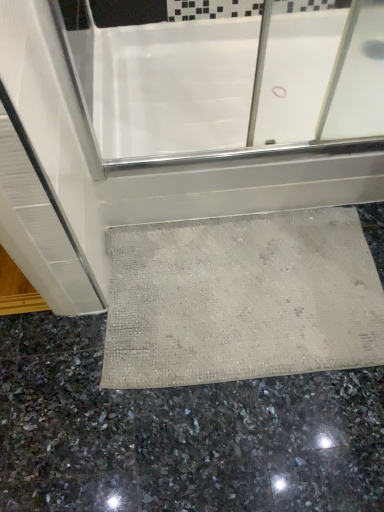
Question: Is white glossy bathtub at center positioned before beige textured bath mat at lower center?

Choices:
 (A) yes
 (B) no

Answer: (B)

Question: Is white glossy bathtub at center bigger than beige textured bath mat at lower center?

Choices:
 (A) yes
 (B) no

Answer: (A)

Question: Can you confirm if white glossy bathtub at center is taller than beige textured bath mat at lower center?

Choices:
 (A) yes
 (B) no

Answer: (A)

Question: Is white glossy bathtub at center wider than beige textured bath mat at lower center?

Choices:
 (A) no
 (B) yes

Answer: (B)

Question: From the image's perspective, is white glossy bathtub at center located beneath beige textured bath mat at lower center?

Choices:
 (A) yes
 (B) no

Answer: (B)

Question: From the image's perspective, is white glossy bathtub at center above or below beige textured bath mat at lower center?

Choices:
 (A) below
 (B) above

Answer: (B)

Question: Is white glossy bathtub at center inside the boundaries of beige textured bath mat at lower center, or outside?

Choices:
 (A) outside
 (B) inside

Answer: (A)

Question: In terms of width, does white glossy bathtub at center look wider or thinner when compared to beige textured bath mat at lower center?

Choices:
 (A) thin
 (B) wide

Answer: (B)

Question: Based on their positions, is white glossy bathtub at center located to the left or right of beige textured bath mat at lower center?

Choices:
 (A) right
 (B) left

Answer: (A)

Question: Considering the positions of white glossy bathtub at center and gray polished granite at lower center in the image, is white glossy bathtub at center wider or thinner than gray polished granite at lower center?

Choices:
 (A) thin
 (B) wide

Answer: (B)

Question: From their relative heights in the image, would you say white glossy bathtub at center is taller or shorter than gray polished granite at lower center?

Choices:
 (A) short
 (B) tall

Answer: (B)

Question: Does point (339, 101) appear closer or farther from the camera than point (46, 394)?

Choices:
 (A) farther
 (B) closer

Answer: (A)

Question: Considering their positions, is white glossy bathtub at center located in front of or behind gray polished granite at lower center?

Choices:
 (A) front
 (B) behind

Answer: (B)

Question: Considering the positions of gray polished granite at lower center and white glossy bathtub at center in the image, is gray polished granite at lower center bigger or smaller than white glossy bathtub at center?

Choices:
 (A) big
 (B) small

Answer: (B)

Question: Looking at their shapes, would you say gray polished granite at lower center is wider or thinner than white glossy bathtub at center?

Choices:
 (A) wide
 (B) thin

Answer: (B)